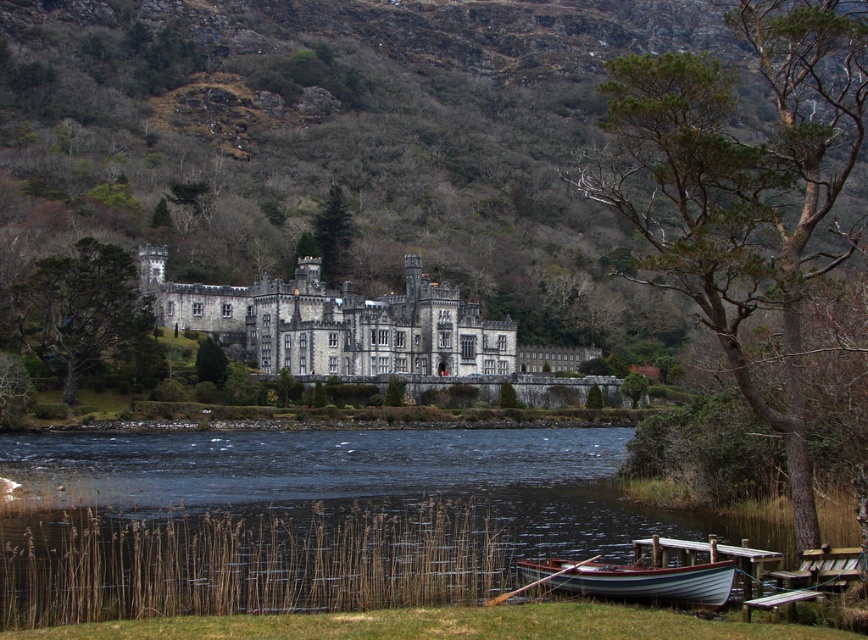
Question: Which object appears closest to the camera in this image?

Choices:
 (A) wooden boat at lower center
 (B) green leafy tree at center

Answer: (A)

Question: Can you confirm if dark water at lower left is wider than green rough bark tree at center right?

Choices:
 (A) no
 (B) yes

Answer: (A)

Question: Is green rough bark tree at center right wider than green leafy tree at center?

Choices:
 (A) yes
 (B) no

Answer: (A)

Question: Does green rough bark tree at center right have a greater width compared to green matte tree at upper center?

Choices:
 (A) no
 (B) yes

Answer: (B)

Question: Based on their relative distances, which object is nearer to the gray stone castle at center?

Choices:
 (A) green matte tree at upper center
 (B) dark water at lower left
 (C) wooden boat at lower center
 (D) green rough bark tree at center right

Answer: (A)

Question: Estimate the real-world distances between objects in this image. Which object is closer to the green matte tree at upper center?

Choices:
 (A) gray stone castle at center
 (B) wooden boat at lower center
 (C) green leafy tree at center
 (D) green rough bark tree at center right

Answer: (A)